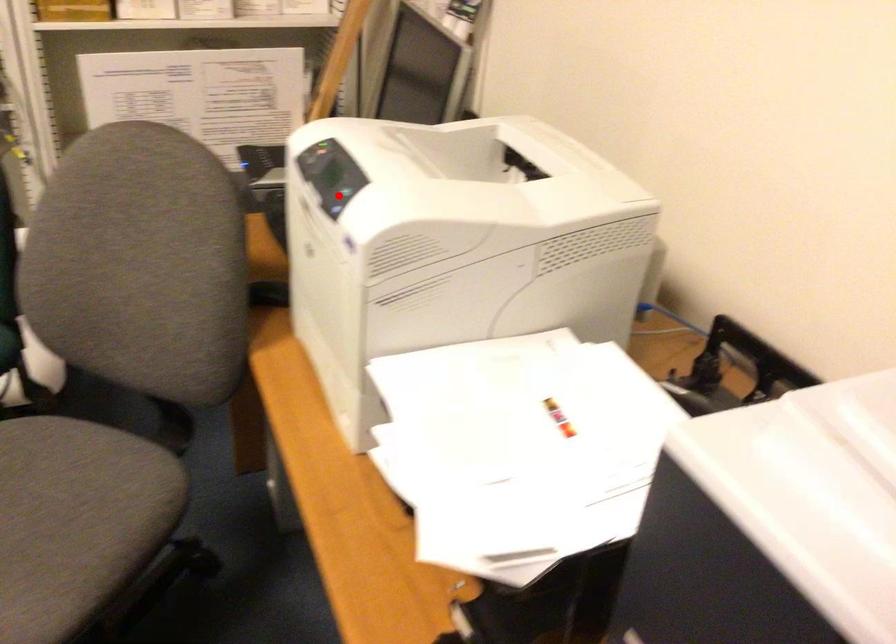
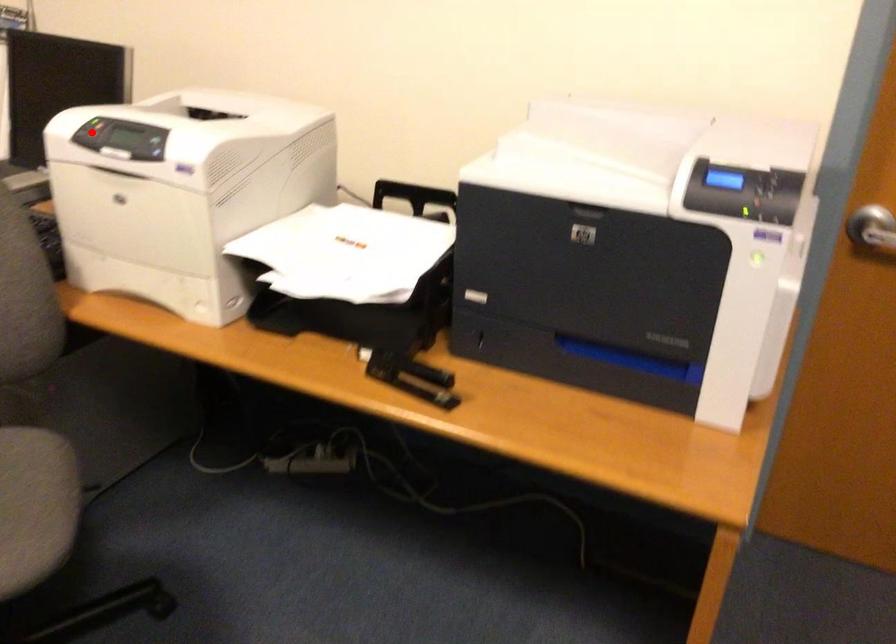
I am providing you with two images of the same scene from different viewpoints. A red point is marked on the first image and another point is marked on the second image. Does the point marked in image1 correspond to the same location as the one in image2?

No